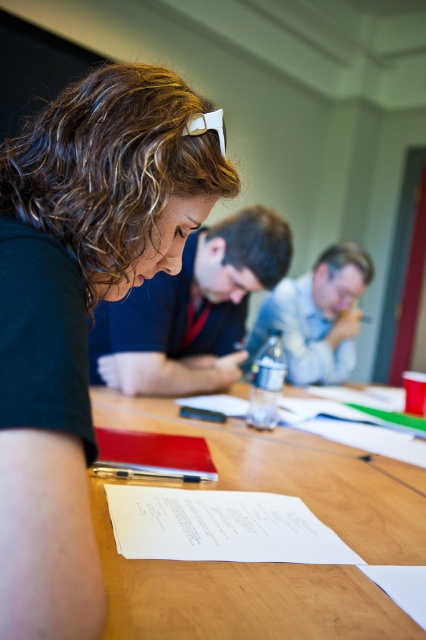
Who is shorter, white paper at center or matte black notepad at center?

matte black notepad at center

Locate an element on the screen. The width and height of the screenshot is (426, 640). white paper at center is located at coordinates (219, 525).

I want to click on white paper at center, so click(219, 525).

Is point (222, 545) behind point (353, 336)?

No, it is in front of (353, 336).

Is white paper at center taller than metallic silver water bottle at center?

No.

Find the location of a particular element. The width and height of the screenshot is (426, 640). white paper at center is located at coordinates (219, 525).

Locate an element on the screen. Image resolution: width=426 pixels, height=640 pixels. white paper at center is located at coordinates (219, 525).

Between point (175, 356) and point (201, 532), which one is positioned in front?

Positioned in front is point (201, 532).

Is matte black shirt at center to the right of white paper at center from the viewer's perspective?

Incorrect, matte black shirt at center is not on the right side of white paper at center.

Is point (210, 339) farther from camera compared to point (210, 518)?

Yes, point (210, 339) is farther from viewer.

The height and width of the screenshot is (640, 426). I want to click on matte black shirt at center, so click(190, 310).